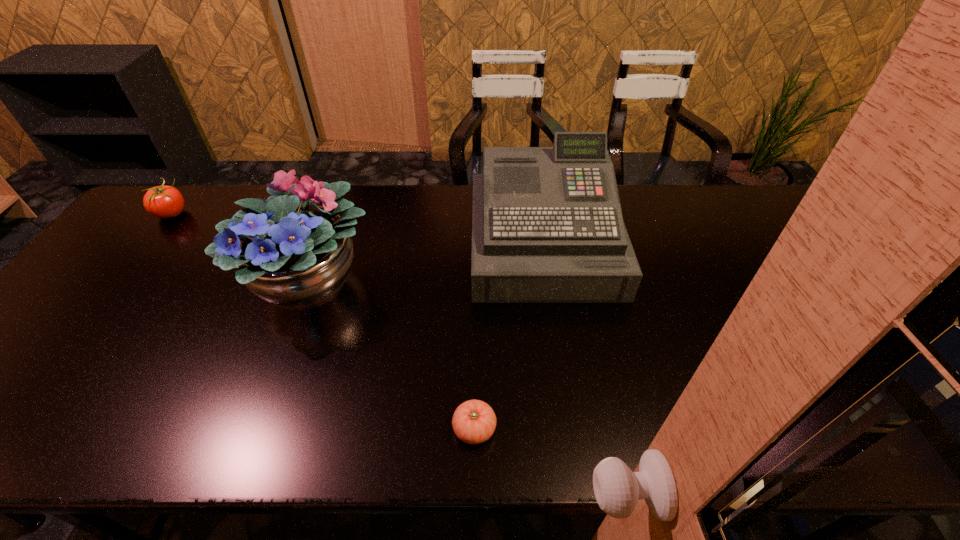
Identify the location of vacant space in between the third tallest object and the shortest object. (324, 321).

Find the location of a particular element. The width and height of the screenshot is (960, 540). free space between the right tomato and the cash register is located at coordinates (509, 337).

At what (x,y) coordinates should I click in order to perform the action: click on vacant point located between the shorter tomato and the farther tomato. Please return your answer as a coordinate pair (x, y). The image size is (960, 540). Looking at the image, I should click on (324, 321).

Locate an element on the screen. free spot between the second shortest object and the right tomato is located at coordinates (324, 321).

Where is `vacant space that's between the cash register and the leftmost object`? The width and height of the screenshot is (960, 540). vacant space that's between the cash register and the leftmost object is located at coordinates (358, 230).

You are a GUI agent. You are given a task and a screenshot of the screen. Output one action in this format:
    pyautogui.click(x=<x>, y=<y>)
    Task: Click on the free spot between the right tomato and the bouquet
    This screenshot has height=540, width=960.
    Given the screenshot: What is the action you would take?
    pyautogui.click(x=393, y=356)

Find the location of a particular element. The image size is (960, 540). free space between the taller tomato and the right tomato is located at coordinates (324, 321).

Where is `the closest object to the leftmost object`? This screenshot has width=960, height=540. the closest object to the leftmost object is located at coordinates (289, 251).

Image resolution: width=960 pixels, height=540 pixels. Find the location of `object that stands as the closest to the second object from left to right`. object that stands as the closest to the second object from left to right is located at coordinates (547, 227).

Find the location of a particular element. free space that satisfies the following two spatial constraints: 1. on the front side of the bouquet; 2. on the left side of the third tallest object is located at coordinates (118, 282).